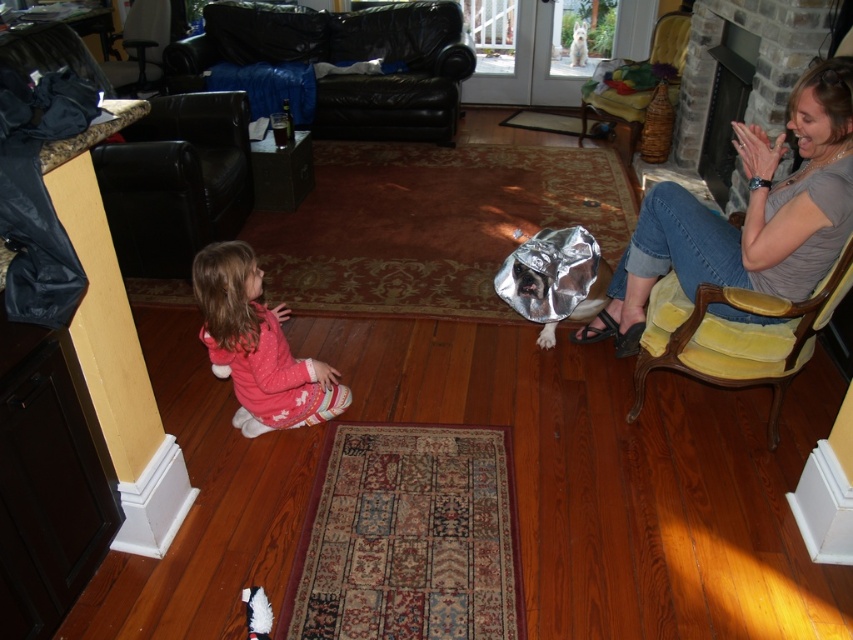
Question: Can you confirm if yellow velvet armchair at right is smaller than pink fleece pants at lower left?

Choices:
 (A) yes
 (B) no

Answer: (B)

Question: Which of these objects is positioned closest to the black leather armchair at left?

Choices:
 (A) black leather couch at upper left
 (B) pink fleece pants at lower left

Answer: (B)

Question: Which object is the closest to the velvet yellow armchair at upper right?

Choices:
 (A) brick fireplace at right
 (B) denim jeans at right
 (C) yellow velvet armchair at right
 (D) black leather armchair at upper left

Answer: (A)

Question: Does denim jeans at right have a smaller size compared to black leather armchair at left?

Choices:
 (A) no
 (B) yes

Answer: (B)

Question: Considering the real-world distances, which object is farthest from the black leather armchair at upper left?

Choices:
 (A) pink fleece pants at lower left
 (B) black leather couch at upper left
 (C) black leather armchair at left
 (D) denim jeans at right

Answer: (D)

Question: Is denim jeans at right to the right of brick fireplace at right from the viewer's perspective?

Choices:
 (A) no
 (B) yes

Answer: (A)